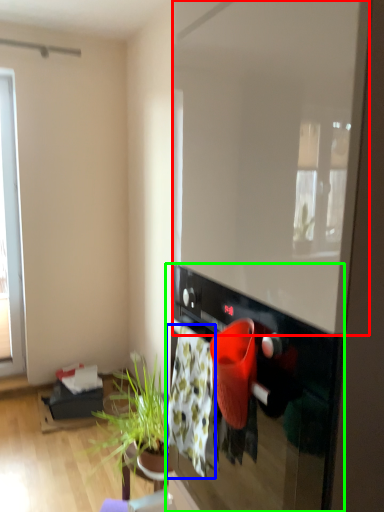
Question: Estimate the real-world distances between objects in this image. Which object is closer to window screen (highlighted by a red box), blanket (highlighted by a blue box) or oven (highlighted by a green box)?

Choices:
 (A) blanket
 (B) oven

Answer: (B)